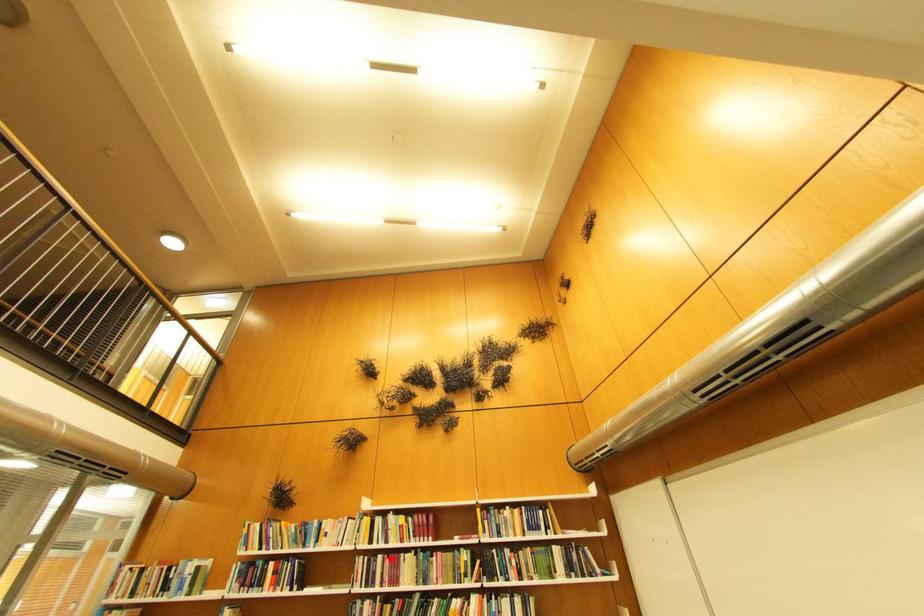
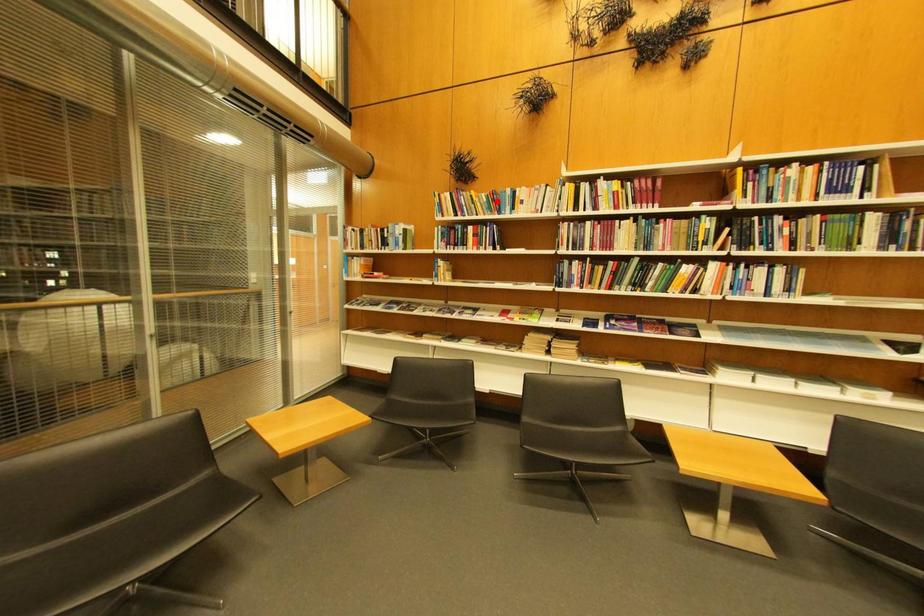
I am providing you with two images of the same scene from different viewpoints. A red point is marked on the first image and another point is marked on the second image. Do the highlighted points in image1 and image2 indicate the same real-world spot?

No